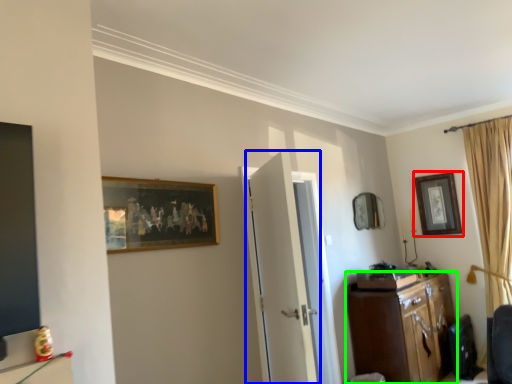
Question: Estimate the real-world distances between objects in this image. Which object is farther from picture frame (highlighted by a red box), door (highlighted by a blue box) or cabinetry (highlighted by a green box)?

Choices:
 (A) door
 (B) cabinetry

Answer: (A)